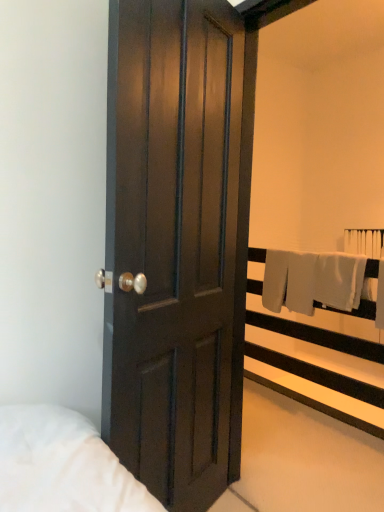
Question: Can you confirm if dark wood door at center is taller than white fabric at upper right?

Choices:
 (A) yes
 (B) no

Answer: (A)

Question: Is dark wood door at center wider than white fabric at upper right?

Choices:
 (A) yes
 (B) no

Answer: (B)

Question: Is dark wood door at center facing towards white fabric at upper right?

Choices:
 (A) no
 (B) yes

Answer: (A)

Question: From the image's perspective, is dark wood door at center on top of white fabric at upper right?

Choices:
 (A) yes
 (B) no

Answer: (A)

Question: Is dark wood door at center facing away from white fabric at upper right?

Choices:
 (A) no
 (B) yes

Answer: (A)

Question: Does dark wood door at center have a larger size compared to white fabric at upper right?

Choices:
 (A) no
 (B) yes

Answer: (A)

Question: From the image's perspective, is white fabric at upper right over dark wood door at center?

Choices:
 (A) no
 (B) yes

Answer: (A)

Question: Does white fabric at upper right have a greater height compared to dark wood door at center?

Choices:
 (A) no
 (B) yes

Answer: (A)

Question: Is white fabric at upper right to the right of dark wood door at center from the viewer's perspective?

Choices:
 (A) no
 (B) yes

Answer: (B)

Question: Is white fabric at upper right smaller than dark wood door at center?

Choices:
 (A) no
 (B) yes

Answer: (A)

Question: Is white fabric at upper right next to dark wood door at center?

Choices:
 (A) no
 (B) yes

Answer: (A)

Question: Can you confirm if white fabric at upper right is shorter than dark wood door at center?

Choices:
 (A) no
 (B) yes

Answer: (B)

Question: In terms of height, does dark wood door at center look taller or shorter compared to white fabric at upper right?

Choices:
 (A) short
 (B) tall

Answer: (B)